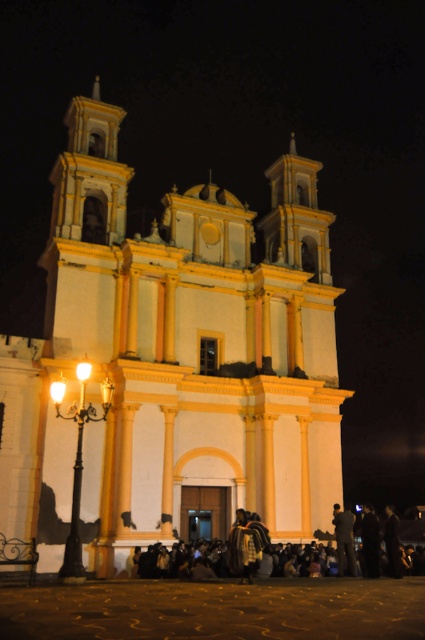
Question: Is yellow matte church at center above dark fabric coat at lower right?

Choices:
 (A) yes
 (B) no

Answer: (A)

Question: Based on their relative distances, which object is farther from the dark gray fabric jacket at lower center?

Choices:
 (A) dark fabric jacket at lower center
 (B) yellow matte church at center
 (C) dark clothing at lower center
 (D) dark fabric coat at lower right

Answer: (B)

Question: Which of the following is the farthest from the observer?

Choices:
 (A) dark fabric coat at lower right
 (B) yellow matte church at center
 (C) dark gray fabric jacket at lower center
 (D) dark fabric jacket at lower center

Answer: (A)

Question: Is dark clothing at lower center above dark fabric jacket at lower center?

Choices:
 (A) no
 (B) yes

Answer: (B)

Question: Estimate the real-world distances between objects in this image. Which object is farther from the dark clothing at lower center?

Choices:
 (A) dark fabric jacket at lower center
 (B) yellow matte church at center
 (C) dark gray fabric jacket at lower center

Answer: (B)

Question: Is dark clothing at lower center in front of dark gray fabric jacket at lower center?

Choices:
 (A) yes
 (B) no

Answer: (A)